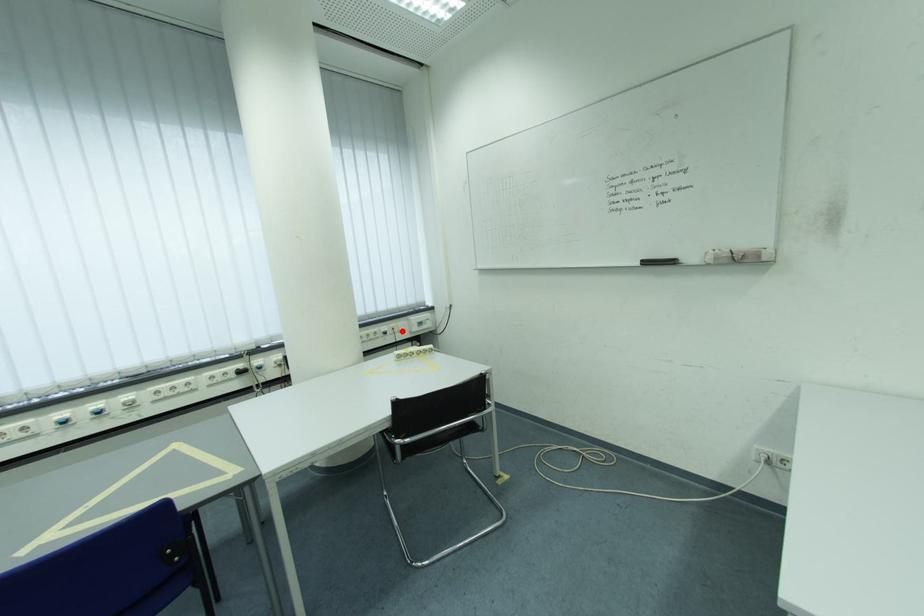
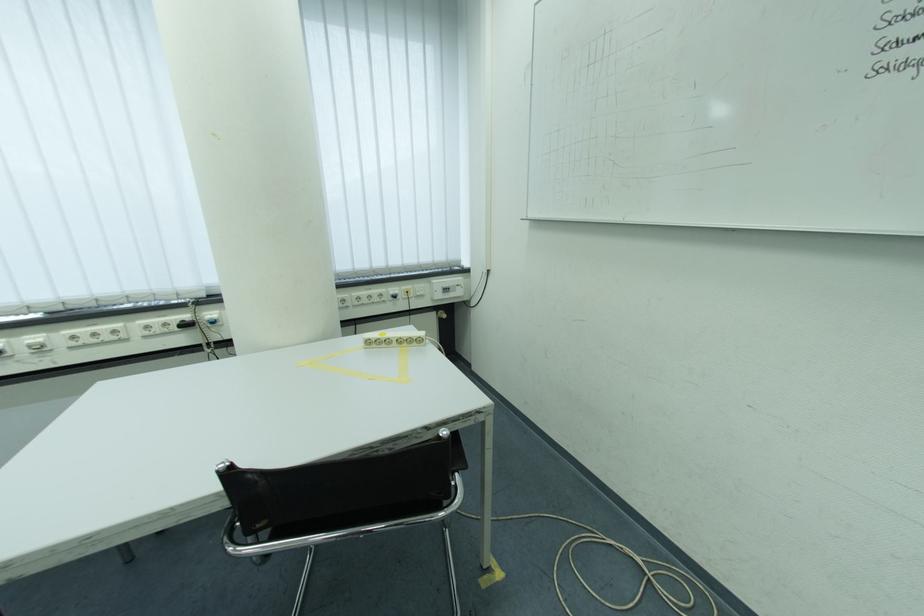
Find the pixel in the second image that matches the highlighted location in the first image.

(417, 294)